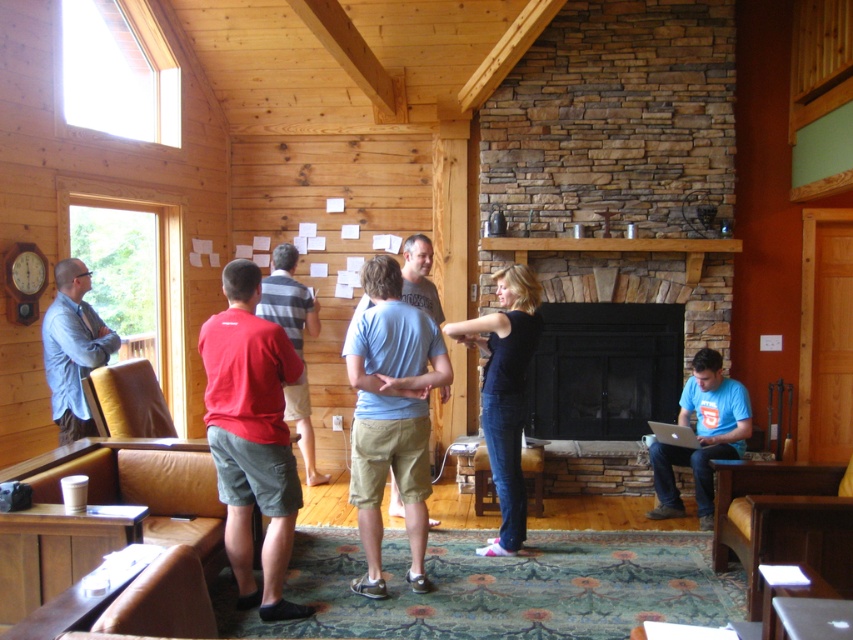
Who is lower down, black cotton shirt at center or red cotton shirt at center?

black cotton shirt at center is lower down.

The width and height of the screenshot is (853, 640). Identify the location of black cotton shirt at center. (505, 392).

Does black cotton shirt at center appear under matte blue shirt at left?

Yes.

Is black cotton shirt at center thinner than matte blue shirt at left?

Incorrect, black cotton shirt at center's width is not less than matte blue shirt at left's.

This screenshot has width=853, height=640. What are the coordinates of `black cotton shirt at center` in the screenshot? It's located at (505, 392).

Does point (743, 413) lie behind point (70, 372)?

Yes, point (743, 413) is behind point (70, 372).

Does blue t-shirt at right appear under matte blue shirt at left?

Yes, blue t-shirt at right is below matte blue shirt at left.

Between point (706, 520) and point (86, 426), which one is positioned in front?

Positioned in front is point (86, 426).

I want to click on blue t-shirt at right, so click(701, 436).